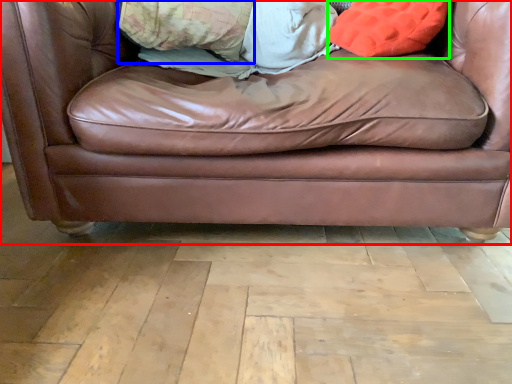
Question: Which object is the farthest from studio couch (highlighted by a red box)? Choose among these: pillow (highlighted by a blue box) or throw pillow (highlighted by a green box).

Choices:
 (A) pillow
 (B) throw pillow

Answer: (A)